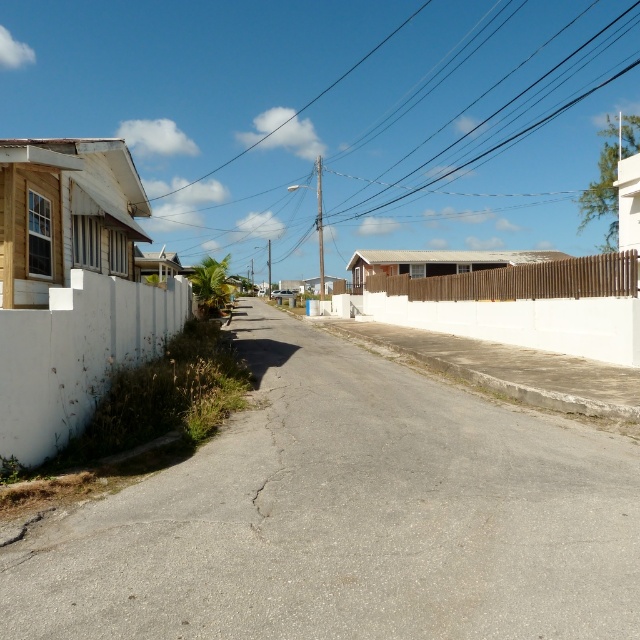
You are a painter who wants to paint both the black wire at upper center and the brown wooden fence at center. Which object requires more paint due to its larger width?

The black wire at upper center requires more paint because its width is larger than the brown wooden fence at center.

You are standing at the point labeled as point (524, 305) on the residential street. Looking around, you see a wooden house with a light brown exterior and a sloped roof on the left side of the street. What object is directly behind you at this point?

The point (524, 305) is on the white wooden fence at center, so the white wooden fence is directly behind you.

You are a delivery person trying to navigate a narrow path between the black wire at upper center and the white wooden fence at center. Can you pass through the space between them?

The black wire at upper center is larger in size than the white wooden fence at center, so the space between them may be too narrow for the delivery person to pass through safely.